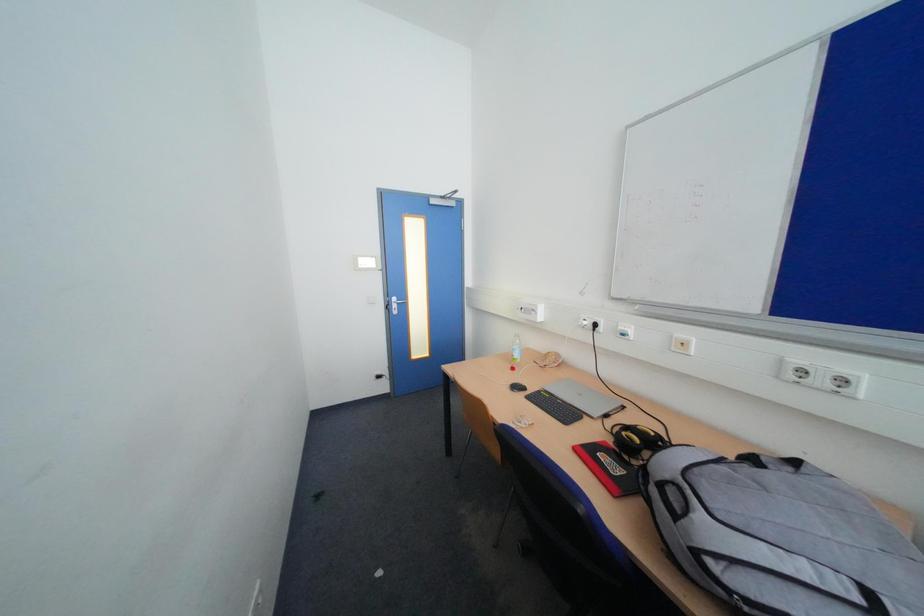
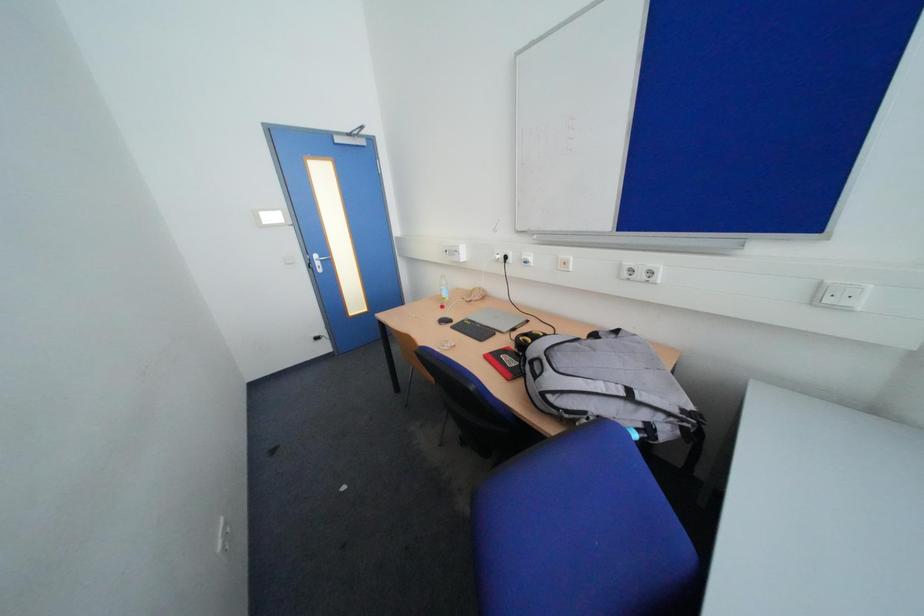
Question: Based on the continuous images, in which direction is the camera rotating? Reply with the corresponding letter.

Choices:
 (A) Left
 (B) Right
 (C) Up
 (D) Down

Answer: (D)